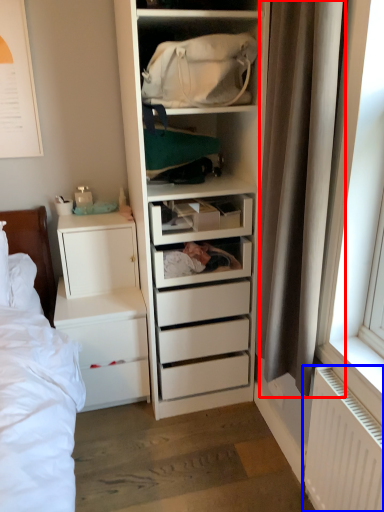
Question: Among these objects, which one is nearest to the camera, curtain (highlighted by a red box) or radiator (highlighted by a blue box)?

Choices:
 (A) curtain
 (B) radiator

Answer: (A)